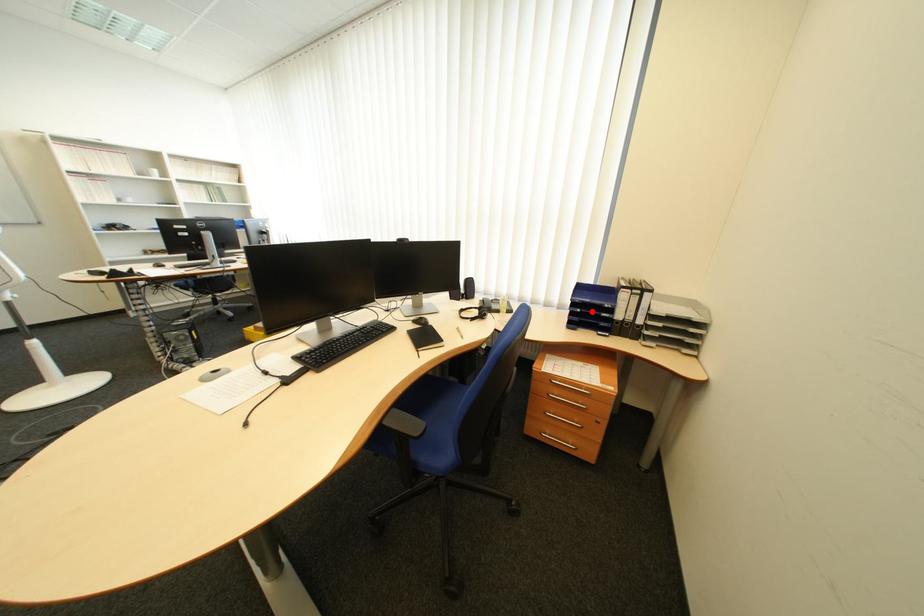
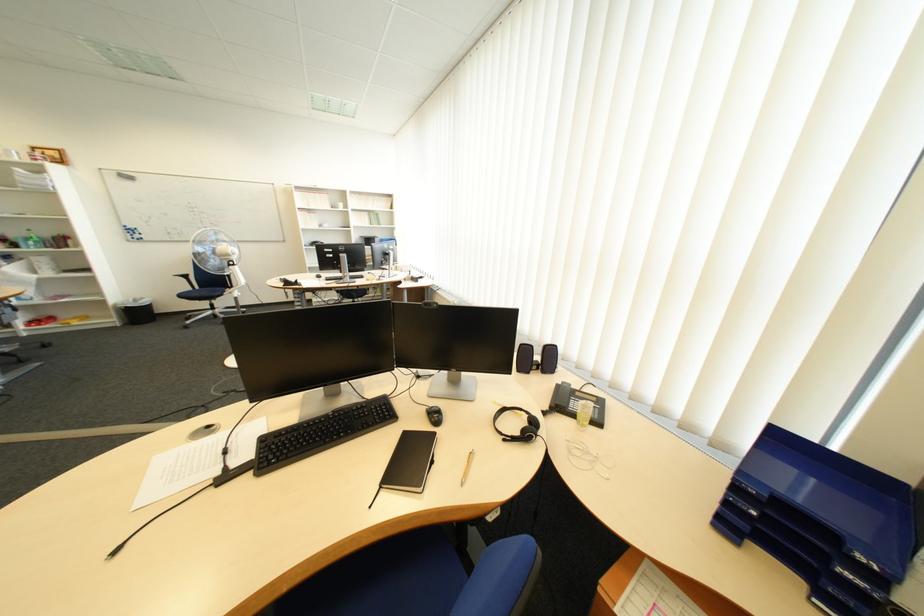
Where in the second image is the point corresponding to the highlighted location from the first image?

(767, 514)